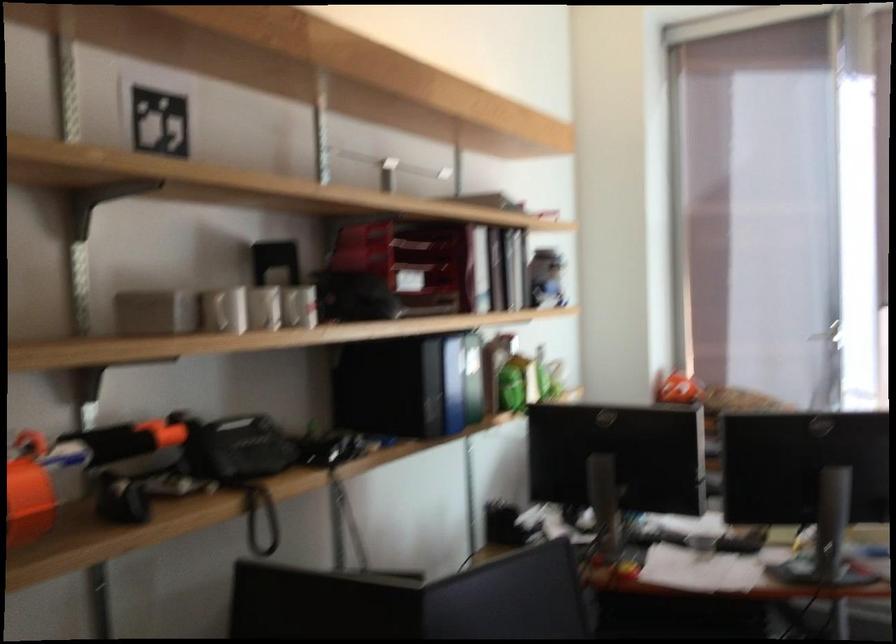
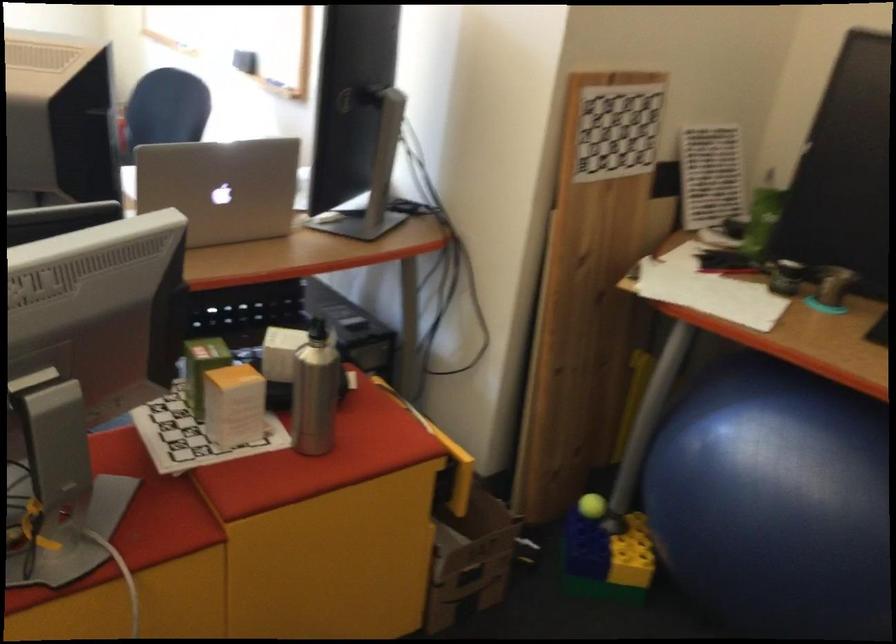
Consider the image. First-person continuous shooting, in which direction is the camera rotating?

The camera's rotation is toward right-down.